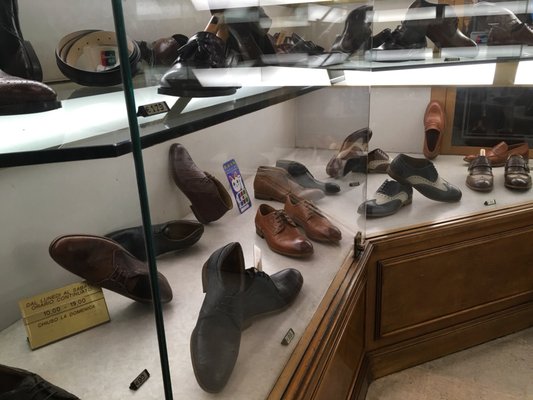
Identify the location of cabinet. click(x=462, y=276), click(x=349, y=365).